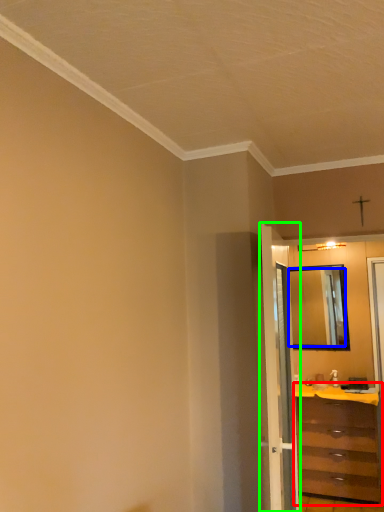
Question: Which is nearer to the chest of drawers (highlighted by a red box)? mirror (highlighted by a blue box) or door (highlighted by a green box).

Choices:
 (A) mirror
 (B) door

Answer: (A)